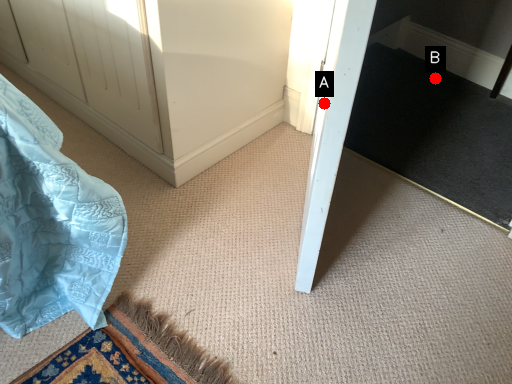
Question: Two points are circled on the image, labeled by A and B beside each circle. Which point appears farthest from the camera in this image?

Choices:
 (A) A is further
 (B) B is further

Answer: (B)